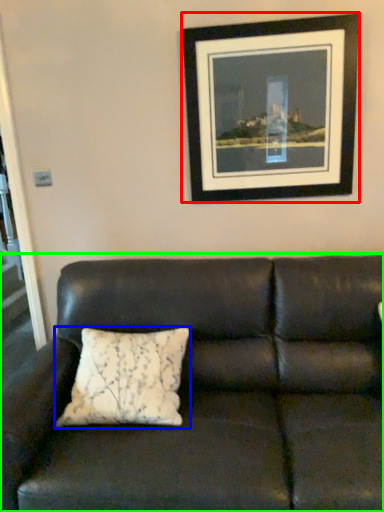
Question: Which object is positioned closest to picture frame (highlighted by a red box)? Select from pillow (highlighted by a blue box) and studio couch (highlighted by a green box).

Choices:
 (A) pillow
 (B) studio couch

Answer: (B)